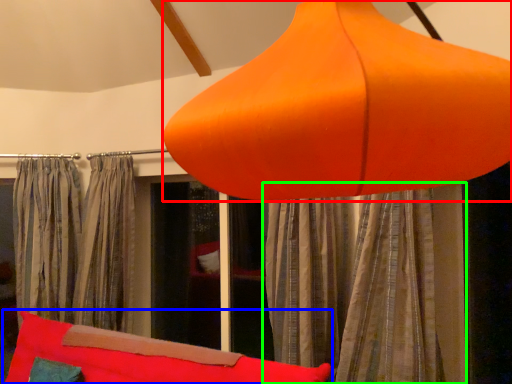
Question: Considering the real-world distances, which object is farthest from lamp (highlighted by a red box)? bean bag chair (highlighted by a blue box) or curtain (highlighted by a green box)?

Choices:
 (A) bean bag chair
 (B) curtain

Answer: (A)